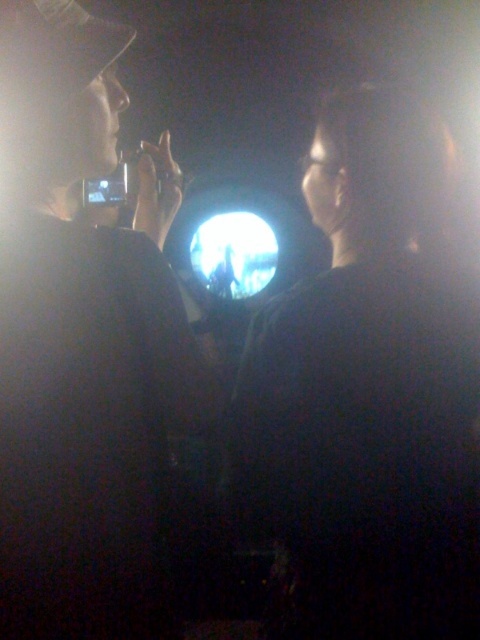
Can you confirm if black matte face at center is bigger than matte black phone at left?

No, black matte face at center is not bigger than matte black phone at left.

The height and width of the screenshot is (640, 480). Describe the element at coordinates (369, 394) in the screenshot. I see `black matte face at center` at that location.

The width and height of the screenshot is (480, 640). Identify the location of black matte face at center. (369, 394).